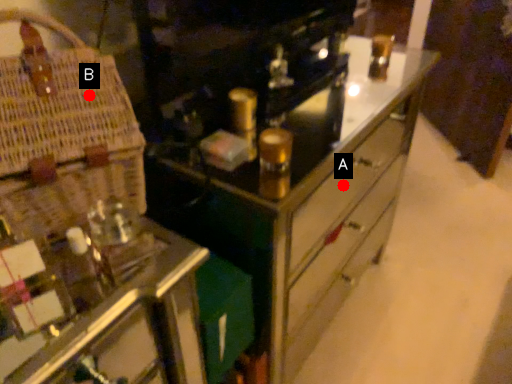
Question: Two points are circled on the image, labeled by A and B beside each circle. Which point appears farthest from the camera in this image?

Choices:
 (A) A is further
 (B) B is further

Answer: (A)